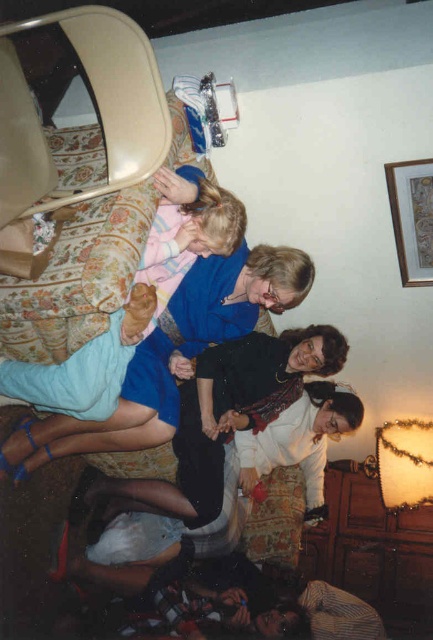
Question: Which of the following is the farthest from the observer?

Choices:
 (A) blue fabric dress at center
 (B) light blue denim pants at center

Answer: (A)

Question: Can you confirm if blue fabric dress at center is thinner than light blue denim pants at center?

Choices:
 (A) no
 (B) yes

Answer: (A)

Question: Which point appears closest to the camera in this image?

Choices:
 (A) (28, 442)
 (B) (157, 212)

Answer: (B)

Question: Does blue fabric dress at center have a lesser width compared to light blue denim pants at center?

Choices:
 (A) yes
 (B) no

Answer: (B)

Question: Considering the relative positions of blue fabric dress at center and light blue denim pants at center in the image provided, where is blue fabric dress at center located with respect to light blue denim pants at center?

Choices:
 (A) above
 (B) below

Answer: (B)